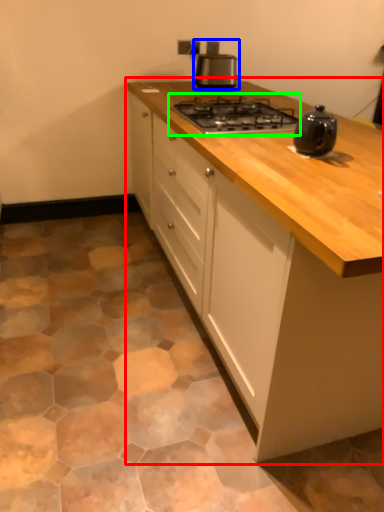
Question: Estimate the real-world distances between objects in this image. Which object is closer to cabinetry (highlighted by a red box), kitchen appliance (highlighted by a blue box) or gas stove (highlighted by a green box)?

Choices:
 (A) kitchen appliance
 (B) gas stove

Answer: (B)